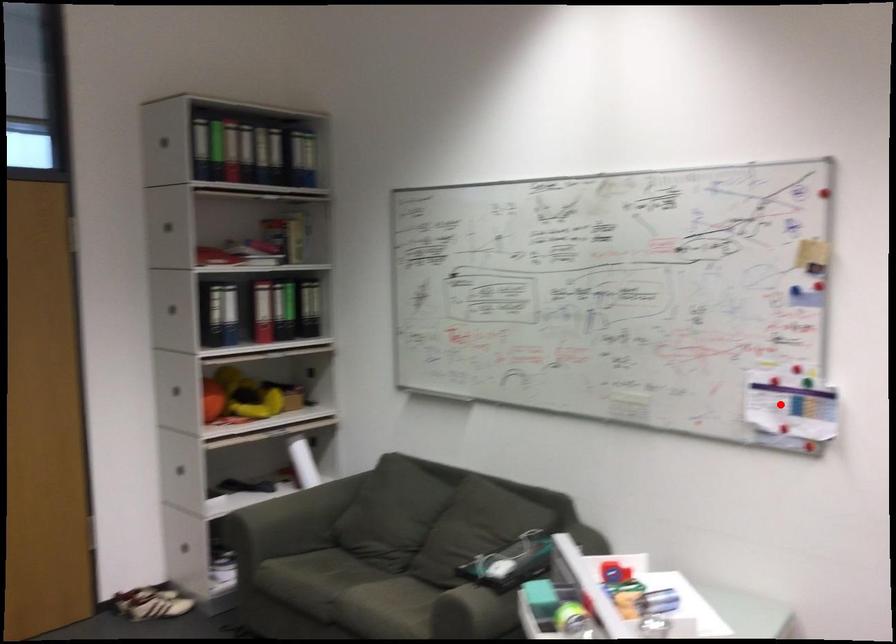
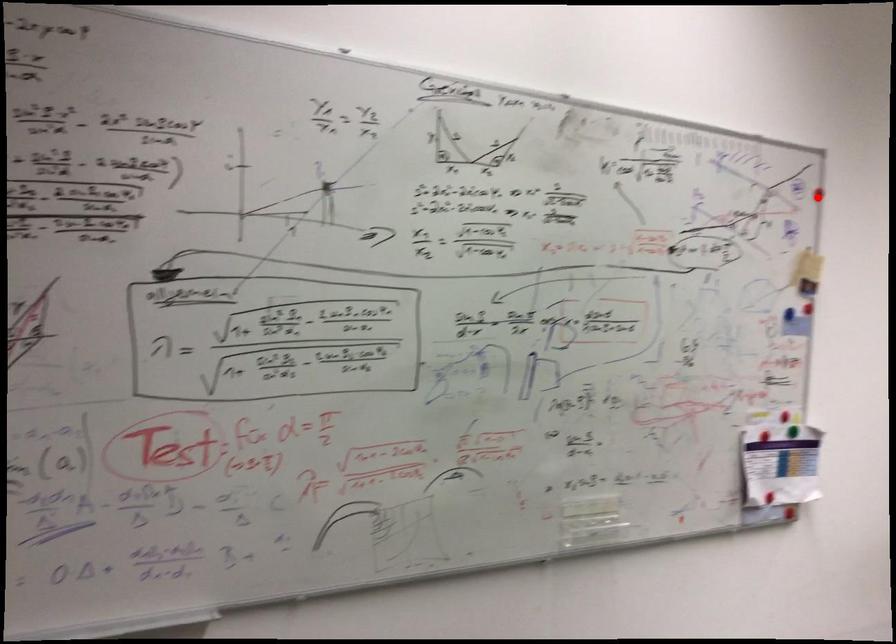
From the picture: I am providing you with two images of the same scene from different viewpoints. A red point is marked on the first image and another point is marked on the second image. Is the red point in image1 aligned with the point shown in image2?

No